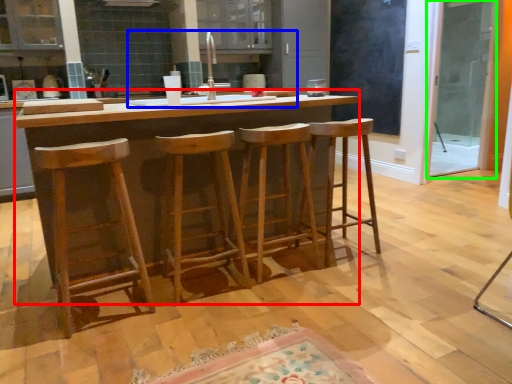
Question: Based on their relative distances, which object is farther from table (highlighted by a red box)? Choose from sink (highlighted by a blue box) and screen door (highlighted by a green box).

Choices:
 (A) sink
 (B) screen door

Answer: (B)